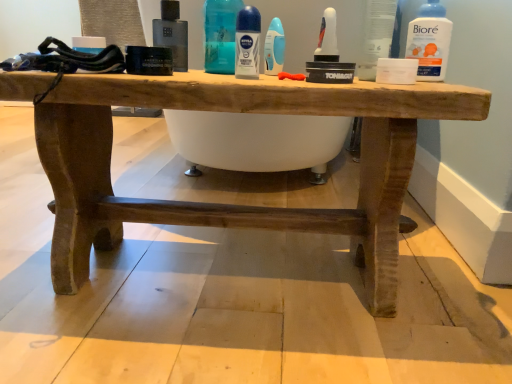
Question: Is there a large distance between blue glossy deodorant stick at center, the 2th cleaning product viewed from the left, and white plastic bottle at upper right, the third mouthwash when ordered from left to right?

Choices:
 (A) yes
 (B) no

Answer: (B)

Question: Would you say blue glossy deodorant stick at center, positioned as the first cleaning product in right-to-left order, is outside white plastic bottle at upper right, the third mouthwash when ordered from left to right?

Choices:
 (A) no
 (B) yes

Answer: (B)

Question: Is blue glossy deodorant stick at center, the 2th cleaning product viewed from the left, smaller than white plastic bottle at upper right, which is the 1th mouthwash in right-to-left order?

Choices:
 (A) no
 (B) yes

Answer: (B)

Question: Does blue glossy deodorant stick at center, the 2th cleaning product viewed from the left, have a lesser height compared to white plastic bottle at upper right, the third mouthwash when ordered from left to right?

Choices:
 (A) no
 (B) yes

Answer: (B)

Question: From the image's perspective, is blue glossy deodorant stick at center, the 2th cleaning product viewed from the left, located above white plastic bottle at upper right, which is the 1th mouthwash in right-to-left order?

Choices:
 (A) no
 (B) yes

Answer: (A)

Question: Considering the positions of point (275, 36) and point (436, 4), is point (275, 36) closer or farther from the camera than point (436, 4)?

Choices:
 (A) closer
 (B) farther

Answer: (B)

Question: Considering the positions of blue glossy deodorant stick at center, the 2th cleaning product viewed from the left, and white plastic bottle at upper right, the third mouthwash when ordered from left to right, in the image, is blue glossy deodorant stick at center, the 2th cleaning product viewed from the left, taller or shorter than white plastic bottle at upper right, the third mouthwash when ordered from left to right,?

Choices:
 (A) tall
 (B) short

Answer: (B)

Question: In terms of size, does blue glossy deodorant stick at center, positioned as the first cleaning product in right-to-left order, appear bigger or smaller than white plastic bottle at upper right, which is the 1th mouthwash in right-to-left order?

Choices:
 (A) small
 (B) big

Answer: (A)

Question: From a real-world perspective, relative to white plastic bottle at upper right, which is the 1th mouthwash in right-to-left order, is blue glossy deodorant stick at center, the 2th cleaning product viewed from the left, vertically above or below?

Choices:
 (A) above
 (B) below

Answer: (B)

Question: Considering the positions of rustic wood table at center and white plastic bottle at upper right, the third mouthwash when ordered from left to right, in the image, is rustic wood table at center taller or shorter than white plastic bottle at upper right, the third mouthwash when ordered from left to right,?

Choices:
 (A) short
 (B) tall

Answer: (B)

Question: Would you say rustic wood table at center is to the left or to the right of white plastic bottle at upper right, which is the 1th mouthwash in right-to-left order, in the picture?

Choices:
 (A) right
 (B) left

Answer: (B)

Question: Does point (79, 170) appear closer or farther from the camera than point (430, 3)?

Choices:
 (A) closer
 (B) farther

Answer: (B)

Question: Is rustic wood table at center spatially inside white plastic bottle at upper right, which is the 1th mouthwash in right-to-left order, or outside of it?

Choices:
 (A) inside
 (B) outside

Answer: (B)

Question: Relative to blue glossy deodorant stick at center, positioned as the first cleaning product in right-to-left order, is blue plastic deodorant at center, the 1th cleaning product positioned from the left, in front or behind?

Choices:
 (A) behind
 (B) front

Answer: (B)

Question: From the image's perspective, is blue plastic deodorant at center, placed as the 2th cleaning product when sorted from right to left, positioned above or below blue glossy deodorant stick at center, positioned as the first cleaning product in right-to-left order?

Choices:
 (A) above
 (B) below

Answer: (A)